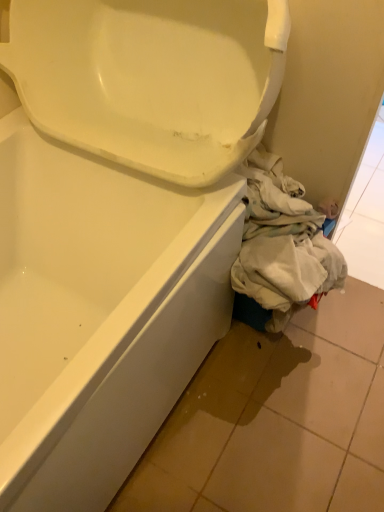
Question: Should I look upward or downward to see matte white tile at lower right?

Choices:
 (A) up
 (B) down

Answer: (B)

Question: Can you confirm if matte white tile at lower right is positioned to the right of light beige fabric at lower right?

Choices:
 (A) no
 (B) yes

Answer: (B)

Question: Is light beige fabric at lower right a part of matte white tile at lower right?

Choices:
 (A) no
 (B) yes

Answer: (A)

Question: Considering the relative sizes of matte white tile at lower right and light beige fabric at lower right in the image provided, is matte white tile at lower right taller than light beige fabric at lower right?

Choices:
 (A) no
 (B) yes

Answer: (A)

Question: From a real-world perspective, is matte white tile at lower right beneath light beige fabric at lower right?

Choices:
 (A) yes
 (B) no

Answer: (A)

Question: From a real-world perspective, is matte white tile at lower right on light beige fabric at lower right?

Choices:
 (A) no
 (B) yes

Answer: (A)

Question: Could you tell me if matte white tile at lower right is turned towards light beige fabric at lower right?

Choices:
 (A) yes
 (B) no

Answer: (B)

Question: Is light beige fabric at lower right facing towards matte white tile at lower right?

Choices:
 (A) no
 (B) yes

Answer: (A)

Question: Can you confirm if light beige fabric at lower right is thinner than matte white tile at lower right?

Choices:
 (A) yes
 (B) no

Answer: (A)

Question: Is light beige fabric at lower right far away from matte white tile at lower right?

Choices:
 (A) yes
 (B) no

Answer: (B)

Question: From the image's perspective, is light beige fabric at lower right beneath matte white tile at lower right?

Choices:
 (A) no
 (B) yes

Answer: (A)

Question: Is matte white tile at lower right located within light beige fabric at lower right?

Choices:
 (A) no
 (B) yes

Answer: (A)

Question: Can we say light beige fabric at lower right lies outside matte white tile at lower right?

Choices:
 (A) no
 (B) yes

Answer: (B)

Question: Considering the positions of light beige fabric at lower right and matte white tile at lower right in the image, is light beige fabric at lower right taller or shorter than matte white tile at lower right?

Choices:
 (A) tall
 (B) short

Answer: (A)